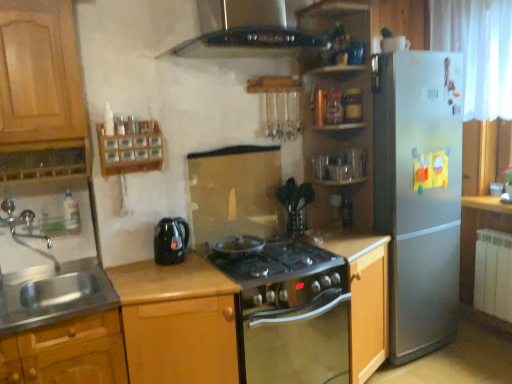
Question: From the image's perspective, is black glass exhaust hood at upper center positioned above or below stainless steel sink at lower left?

Choices:
 (A) above
 (B) below

Answer: (A)

Question: Is point (316, 46) positioned closer to the camera than point (61, 289)?

Choices:
 (A) closer
 (B) farther

Answer: (B)

Question: Which is nearer to the black glass stove at center?

Choices:
 (A) wooden spice rack at upper left
 (B) wooden shelves at upper right
 (C) wooden cabinet at center, the first cabinetry when ordered from right to left
 (D) silver metallic refrigerator at right
 (E) black glossy electric kettle at center-left

Answer: (C)

Question: Based on their relative distances, which object is farther from the wooden cabinet at center, which is counted as the second cabinetry, starting from the right?

Choices:
 (A) metallic oak cabinet at lower left, which is the 3th cabinetry in right-to-left order
 (B) black glass stove at center
 (C) silver metallic refrigerator at right
 (D) stainless steel sink at lower left
 (E) black glossy electric kettle at center-left

Answer: (C)